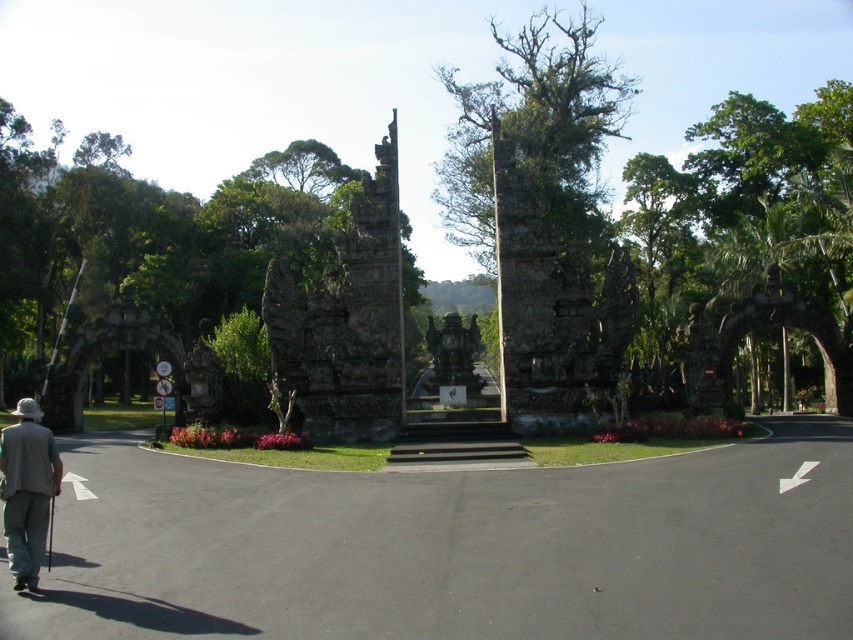
Is green rough stone tree at upper center bigger than gray fabric vest at lower left?

Indeed, green rough stone tree at upper center has a larger size compared to gray fabric vest at lower left.

Who is more distant from viewer, (556, 40) or (57, 474)?

Point (556, 40)

What do you see at coordinates (537, 136) in the screenshot? I see `green rough stone tree at upper center` at bounding box center [537, 136].

At what (x,y) coordinates should I click in order to perform the action: click on green rough stone tree at upper center. Please return your answer as a coordinate pair (x, y). Looking at the image, I should click on (537, 136).

This screenshot has height=640, width=853. Describe the element at coordinates (27, 490) in the screenshot. I see `gray fabric vest at lower left` at that location.

Is gray fabric vest at lower left further to the viewer compared to rustic stone gate at center?

No.

Who is more forward, (4, 524) or (456, 353)?

Point (4, 524)

Locate an element on the screen. The height and width of the screenshot is (640, 853). gray fabric vest at lower left is located at coordinates coord(27,490).

Between point (26, 216) and point (42, 541), which one is positioned behind?

The point (26, 216) is more distant.

Can you confirm if rough stone archway at center is positioned to the right of gray fabric vest at lower left?

Incorrect, rough stone archway at center is not on the right side of gray fabric vest at lower left.

Who is more distant from viewer, (x=238, y=182) or (x=38, y=413)?

The point (x=238, y=182) is more distant.

Find the location of a particular element. rough stone archway at center is located at coordinates (x=149, y=252).